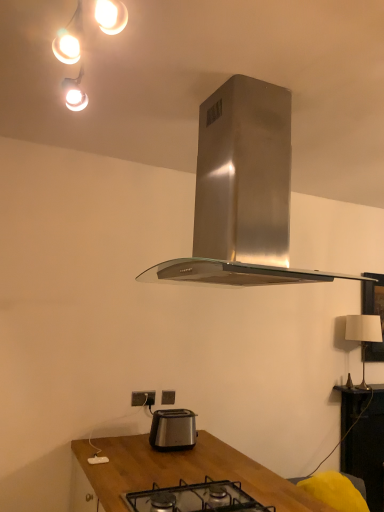
This screenshot has height=512, width=384. What do you see at coordinates (242, 192) in the screenshot?
I see `stainless steel range hood at center` at bounding box center [242, 192].

Describe the element at coordinates (69, 39) in the screenshot. I see `matte white lights at upper left` at that location.

What is the approximate height of satin silver toaster at lower center?

satin silver toaster at lower center is 7.57 inches tall.

Image resolution: width=384 pixels, height=512 pixels. What do you see at coordinates (363, 334) in the screenshot?
I see `white fabric lampshade at right` at bounding box center [363, 334].

What is the approximate height of satin silver power plugs and sockets at lower center, marked as the 1th power plugs and sockets in a right-to-left arrangement?

The height of satin silver power plugs and sockets at lower center, marked as the 1th power plugs and sockets in a right-to-left arrangement, is 3.49 inches.

Where is `stainless steel range hood at center`? stainless steel range hood at center is located at coordinates (242, 192).

Is satin silver power plugs and sockets at lower center, the second power plugs and sockets positioned from the front, positioned far away from white plastic power plugs and sockets at lower center, acting as the first power plugs and sockets starting from the left?

Actually, satin silver power plugs and sockets at lower center, the second power plugs and sockets positioned from the front, and white plastic power plugs and sockets at lower center, acting as the first power plugs and sockets starting from the left, are a little close together.

From the image's perspective, between satin silver power plugs and sockets at lower center, the second power plugs and sockets positioned from the front, and white plastic power plugs and sockets at lower center, the first power plugs and sockets from the front, which one is located above?

white plastic power plugs and sockets at lower center, the first power plugs and sockets from the front, appears higher in the image.

Locate an element on the screen. This screenshot has width=384, height=512. power plugs and sockets on the left of satin silver power plugs and sockets at lower center, marked as the 1th power plugs and sockets in a right-to-left arrangement is located at coordinates (143, 398).

From a real-world perspective, is satin silver power plugs and sockets at lower center, positioned as the second power plugs and sockets in left-to-right order, positioned under white plastic power plugs and sockets at lower center, which is counted as the 2th power plugs and sockets, starting from the back, based on gravity?

Yes, from a real-world perspective, satin silver power plugs and sockets at lower center, positioned as the second power plugs and sockets in left-to-right order, is beneath white plastic power plugs and sockets at lower center, which is counted as the 2th power plugs and sockets, starting from the back.

Does satin silver power plugs and sockets at lower center, which appears as the first power plugs and sockets when viewed from the back, have a smaller size compared to wooden table at lower right?

Indeed, satin silver power plugs and sockets at lower center, which appears as the first power plugs and sockets when viewed from the back, has a smaller size compared to wooden table at lower right.

Is satin silver power plugs and sockets at lower center, which appears as the first power plugs and sockets when viewed from the back, spatially inside wooden table at lower right, or outside of it?

satin silver power plugs and sockets at lower center, which appears as the first power plugs and sockets when viewed from the back, lies outside wooden table at lower right.

Can you tell me how much satin silver power plugs and sockets at lower center, the second power plugs and sockets positioned from the front, and wooden table at lower right differ in facing direction?

0.364 degrees separate the facing orientations of satin silver power plugs and sockets at lower center, the second power plugs and sockets positioned from the front, and wooden table at lower right.

Could you tell me if satin silver power plugs and sockets at lower center, which appears as the first power plugs and sockets when viewed from the back, is turned towards wooden table at lower right?

No, satin silver power plugs and sockets at lower center, which appears as the first power plugs and sockets when viewed from the back, is not aimed at wooden table at lower right.

The width and height of the screenshot is (384, 512). Find the location of `kitchen appliance behind the matte white lights at upper left`. kitchen appliance behind the matte white lights at upper left is located at coordinates (242, 192).

From a real-world perspective, which is physically below, stainless steel range hood at center or matte white lights at upper left?

From a 3D spatial view, stainless steel range hood at center is below.

Is stainless steel range hood at center positioned with its back to matte white lights at upper left?

That's right, stainless steel range hood at center is facing away from matte white lights at upper left.

Does black glass gas stove at center come in front of wooden table at lower right?

Yes, black glass gas stove at center is in front of wooden table at lower right.

Is wooden table at lower right surrounded by black glass gas stove at center?

No, wooden table at lower right is not surrounded by black glass gas stove at center.

Can you confirm if black glass gas stove at center is thinner than wooden table at lower right?

Incorrect, the width of black glass gas stove at center is not less than that of wooden table at lower right.

From a real-world perspective, which object stands above the other?

black glass gas stove at center.

Does matte white lights at upper left have a lesser width compared to black glass gas stove at center?

Yes, matte white lights at upper left is thinner than black glass gas stove at center.

From a real-world perspective, between matte white lights at upper left and black glass gas stove at center, who is vertically higher?

In real-world perspective, matte white lights at upper left is above.

Is matte white lights at upper left positioned in front of black glass gas stove at center?

Yes, matte white lights at upper left is closer to the viewer.

From the image's perspective, is wooden table at lower right over white plastic power plugs and sockets at lower center, acting as the first power plugs and sockets starting from the left?

No, from the image's perspective, wooden table at lower right is not over white plastic power plugs and sockets at lower center, acting as the first power plugs and sockets starting from the left.

Who is shorter, wooden table at lower right or white plastic power plugs and sockets at lower center, acting as the first power plugs and sockets starting from the left?

Result: With less height is white plastic power plugs and sockets at lower center, acting as the first power plugs and sockets starting from the left.

Is wooden table at lower right turned away from white plastic power plugs and sockets at lower center, which is counted as the 2th power plugs and sockets, starting from the back?

No, wooden table at lower right's orientation is not away from white plastic power plugs and sockets at lower center, which is counted as the 2th power plugs and sockets, starting from the back.

Is wooden table at lower right closer to camera compared to white plastic power plugs and sockets at lower center, the first power plugs and sockets from the front?

No, wooden table at lower right is further to the viewer.

Is wooden table at lower right wider or thinner than satin silver toaster at lower center?

wooden table at lower right is thinner than satin silver toaster at lower center.

Is wooden table at lower right with satin silver toaster at lower center?

No, wooden table at lower right is not making contact with satin silver toaster at lower center.

From the picture: What's the angular difference between wooden table at lower right and satin silver toaster at lower center's facing directions?

The angular difference between wooden table at lower right and satin silver toaster at lower center is 0.402 degrees.

Is wooden table at lower right at the left side of satin silver toaster at lower center?

No.

Identify the location of power plugs and sockets that appears on the right of white plastic power plugs and sockets at lower center, which is counted as the 2th power plugs and sockets, starting from the back. This screenshot has width=384, height=512. (168, 397).

From the image's perspective, which power plugs and sockets is the 1st one above the wooden table at lower right? Please provide its 2D coordinates.

[(168, 397)]

From the image, which object appears to be nearer to wooden table at lower right, satin silver toaster at lower center or white fabric lampshade at right?

white fabric lampshade at right lies closer to wooden table at lower right than the other object.

Which object lies nearer to the anchor point white fabric lampshade at right, satin silver toaster at lower center or stainless steel range hood at center?

satin silver toaster at lower center is positioned closer to the anchor white fabric lampshade at right.

In the scene shown: From the image, which object appears to be nearer to black glass gas stove at center, satin silver power plugs and sockets at lower center, the second power plugs and sockets positioned from the front, or stainless steel range hood at center?

satin silver power plugs and sockets at lower center, the second power plugs and sockets positioned from the front, is closer to black glass gas stove at center.

Based on their spatial positions, is stainless steel range hood at center or black glass gas stove at center closer to matte white lights at upper left?

stainless steel range hood at center is closer to matte white lights at upper left.

Looking at this image, estimate the real-world distances between objects in this image. Which object is further from stainless steel range hood at center, black glass gas stove at center or white fabric lampshade at right?

Based on the image, white fabric lampshade at right appears to be further to stainless steel range hood at center.

Which object lies nearer to the anchor point white fabric lampshade at right, satin silver power plugs and sockets at lower center, marked as the 1th power plugs and sockets in a right-to-left arrangement, or stainless steel range hood at center?

satin silver power plugs and sockets at lower center, marked as the 1th power plugs and sockets in a right-to-left arrangement, is positioned closer to the anchor white fabric lampshade at right.

When comparing their distances from matte white lights at upper left, does wooden table at lower right or satin silver toaster at lower center seem further?

wooden table at lower right is positioned further to the anchor matte white lights at upper left.

Estimate the real-world distances between objects in this image. Which object is closer to satin silver toaster at lower center, white fabric lampshade at right or white plastic power plugs and sockets at lower center, acting as the first power plugs and sockets starting from the left?

Based on the image, white plastic power plugs and sockets at lower center, acting as the first power plugs and sockets starting from the left, appears to be nearer to satin silver toaster at lower center.

The image size is (384, 512). I want to click on kitchen appliance between black glass gas stove at center and white plastic power plugs and sockets at lower center, acting as the first power plugs and sockets starting from the left, in the front-back direction, so click(242, 192).

Identify the location of toaster between white plastic power plugs and sockets at lower center, which is counted as the 2th power plugs and sockets, starting from the back, and white fabric lampshade at right, in the horizontal direction. [x=173, y=429].

Where is `gas stove between matte white lights at upper left and wooden table at lower right in the up-down direction`? gas stove between matte white lights at upper left and wooden table at lower right in the up-down direction is located at coordinates (196, 498).

Find the location of a particular element. gas stove between stainless steel range hood at center and satin silver toaster at lower center from top to bottom is located at coordinates point(196,498).